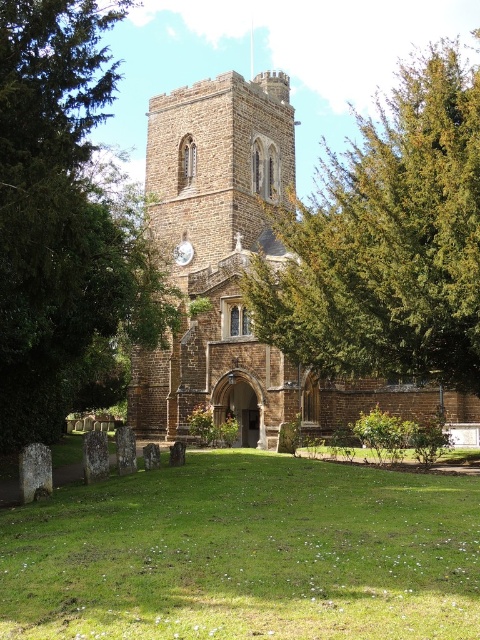
You are standing at the entrance of the historic stone church and see a point marked at coordinates (245,554). According to the image, what is the location of this point relative to the green grass at center?

The point marked at coordinates (245,554) is located on the green grass at center.

You are a gardener who needs to mow the lawn around the green grass at center and the green leafy tree at center. Which object should you avoid cutting with the lawnmower?

You should avoid cutting the green leafy tree at center because the green grass at center is not as tall as the green leafy tree at center, meaning the tree is taller and could be damaged by the lawnmower.